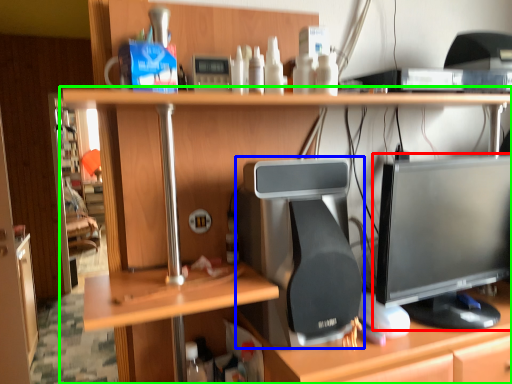
Question: Considering the real-world distances, which object is closest to computer monitor (highlighted by a red box)? desktop computer (highlighted by a blue box) or desk (highlighted by a green box).

Choices:
 (A) desktop computer
 (B) desk

Answer: (A)